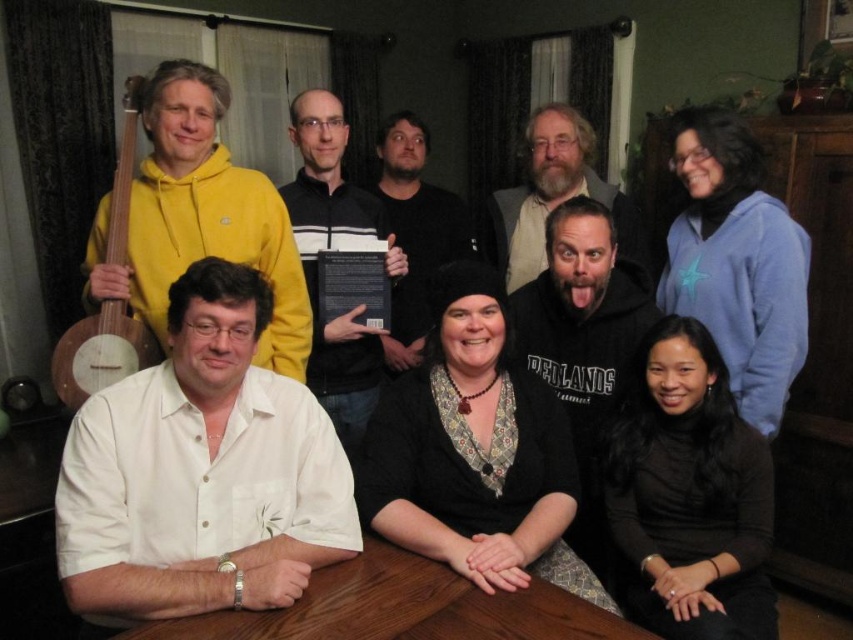
Is point (637, 634) closer to viewer compared to point (341, 273)?

That is True.

Which is behind, point (297, 620) or point (345, 269)?

Positioned behind is point (345, 269).

Where is `brown wooden table at center`? The image size is (853, 640). brown wooden table at center is located at coordinates (404, 609).